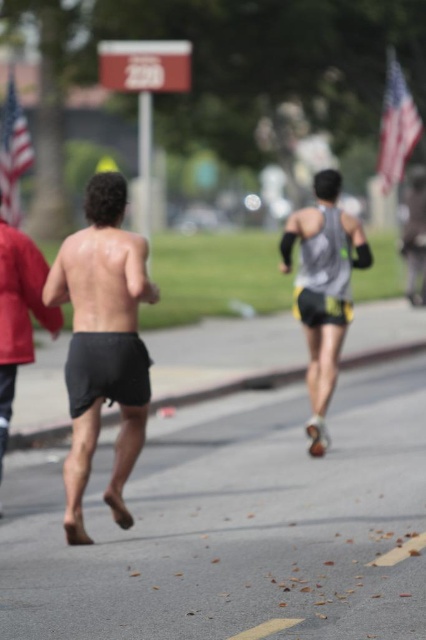
You are a photographer standing at the camera position. You want to capture a closeup shot of the point at coordinates point (313,422). Can you get a clear closeup without moving your position? Please explain your reasoning.

The distance between point (313,422) and the camera is 10.00 meters. To capture a clear closeup, you would need to either move closer or use a zoom lens capable of focusing at that distance. Since moving is not allowed, you must use a suitable zoom lens.

You are a photographer trying to capture both the black matte shorts at center and the american flag at left in a single shot. Based on their sizes in the image, which object would appear smaller in the photo?

The black matte shorts at center would appear smaller in the photo because they are thinner than the american flag at left.